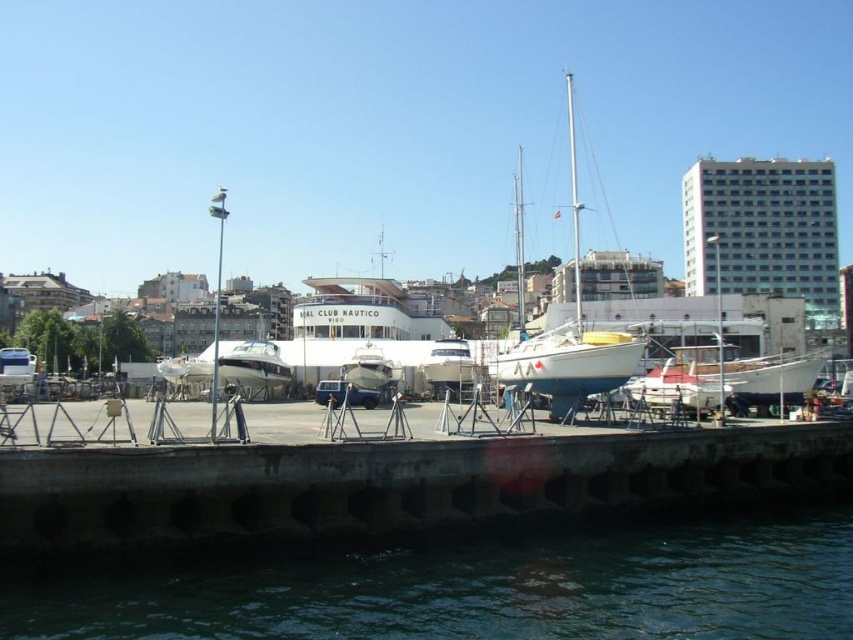
Question: Can you confirm if white glossy boat at center is smaller than matte black car at center?

Choices:
 (A) yes
 (B) no

Answer: (B)

Question: Which object appears closest to the camera in this image?

Choices:
 (A) greenish water at lower center
 (B) white glossy boat at center

Answer: (A)

Question: Does white matte sailboat at center have a lesser width compared to matte black car at center?

Choices:
 (A) no
 (B) yes

Answer: (A)

Question: Which of the following is the farthest from the observer?

Choices:
 (A) matte black car at center
 (B) white matte sailboat at center
 (C) white glossy boat at center

Answer: (A)

Question: Is greenish water at lower center closer to the viewer compared to white glossy boat at center?

Choices:
 (A) yes
 (B) no

Answer: (A)

Question: Among these objects, which one is nearest to the camera?

Choices:
 (A) white matte sailboat at center
 (B) greenish water at lower center
 (C) white glossy boat at center
 (D) matte black car at center

Answer: (B)